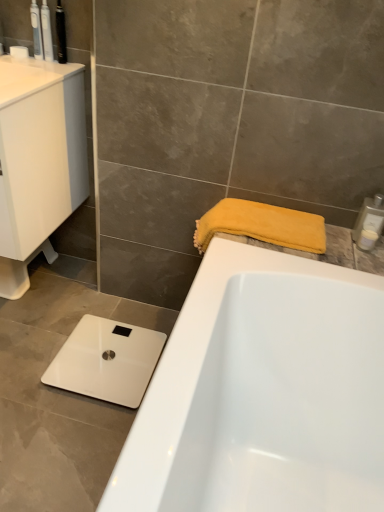
Where is `free space in front of matte white toothbrush at upper left, the fourth toiletry ordered from the bottom`? The image size is (384, 512). free space in front of matte white toothbrush at upper left, the fourth toiletry ordered from the bottom is located at coordinates (46, 69).